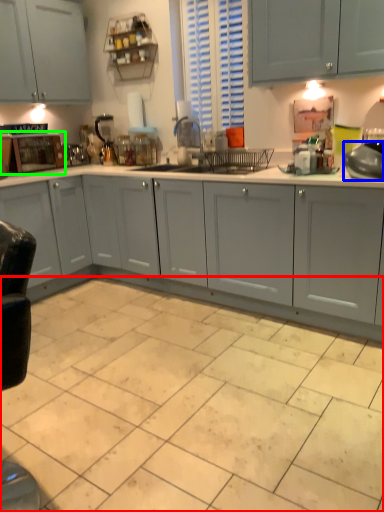
Question: Estimate the real-world distances between objects in this image. Which object is closer to ceramic tile (highlighted by a red box), appliance (highlighted by a blue box) or home appliance (highlighted by a green box)?

Choices:
 (A) appliance
 (B) home appliance

Answer: (A)